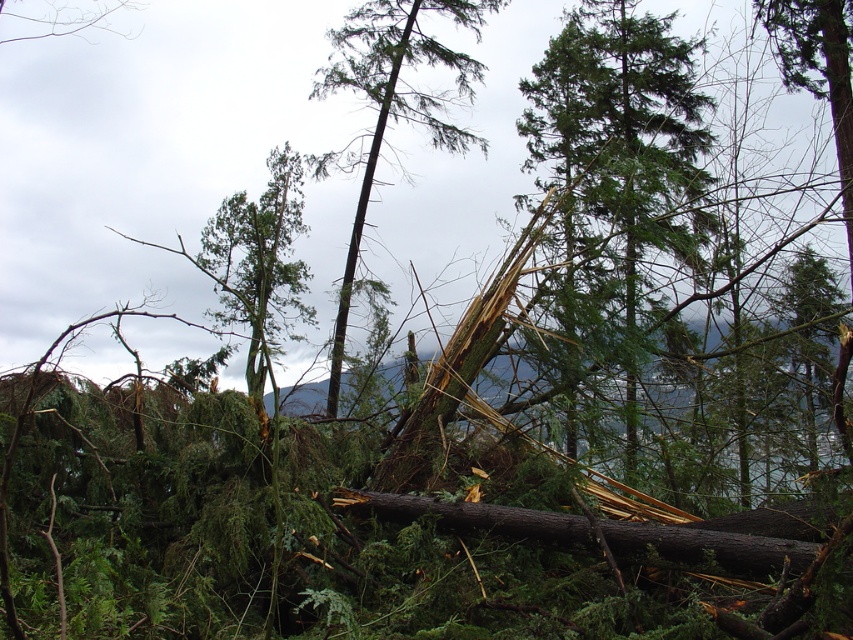
Question: Where is green needle-like at center located in relation to green textured wood at center in the image?

Choices:
 (A) left
 (B) right

Answer: (B)

Question: Which point appears closest to the camera in this image?

Choices:
 (A) (630, 109)
 (B) (415, 58)

Answer: (B)

Question: Which of the following is the farthest from the observer?

Choices:
 (A) (636, 371)
 (B) (469, 141)

Answer: (B)

Question: Can you confirm if green needle-like at center is positioned above green textured wood at center?

Choices:
 (A) no
 (B) yes

Answer: (B)

Question: Is green needle-like at center below green textured wood at center?

Choices:
 (A) yes
 (B) no

Answer: (B)